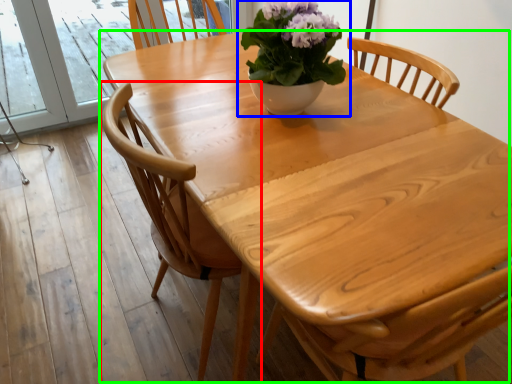
Question: Considering the real-world distances, which object is closest to chair (highlighted by a red box)? houseplant (highlighted by a blue box) or kitchen & dining room table (highlighted by a green box).

Choices:
 (A) houseplant
 (B) kitchen & dining room table

Answer: (B)